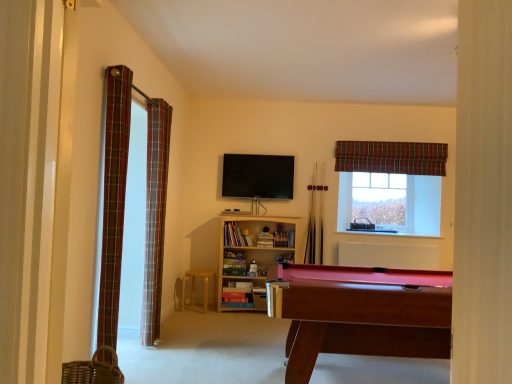
Question: Should I look upward or downward to see plaid fabric curtain at upper right, the 1th curtain when ordered from right to left?

Choices:
 (A) down
 (B) up

Answer: (B)

Question: From the image's perspective, would you say wooden pool cue at center, which is the second cue in left-to-right order, is positioned over clear glass window at upper right?

Choices:
 (A) yes
 (B) no

Answer: (B)

Question: Considering the relative positions of wooden pool cue at center, positioned as the first cue in right-to-left order, and clear glass window at upper right in the image provided, is wooden pool cue at center, positioned as the first cue in right-to-left order, to the right of clear glass window at upper right from the viewer's perspective?

Choices:
 (A) yes
 (B) no

Answer: (B)

Question: Is wooden pool cue at center, which is the second cue in left-to-right order, turned away from clear glass window at upper right?

Choices:
 (A) no
 (B) yes

Answer: (A)

Question: Does wooden pool cue at center, positioned as the first cue in right-to-left order, have a larger size compared to clear glass window at upper right?

Choices:
 (A) no
 (B) yes

Answer: (A)

Question: Is wooden pool cue at center, which is the second cue in left-to-right order, positioned behind clear glass window at upper right?

Choices:
 (A) yes
 (B) no

Answer: (B)

Question: Is wooden pool cue at center, positioned as the first cue in right-to-left order, oriented towards clear glass window at upper right?

Choices:
 (A) yes
 (B) no

Answer: (B)

Question: Is wooden pool cue at center, which is the second cue in left-to-right order, outside wooden billiard table at lower right?

Choices:
 (A) no
 (B) yes

Answer: (B)

Question: Does wooden pool cue at center, which is the second cue in left-to-right order, turn towards wooden billiard table at lower right?

Choices:
 (A) yes
 (B) no

Answer: (B)

Question: From the image's perspective, would you say wooden pool cue at center, positioned as the first cue in right-to-left order, is shown under wooden billiard table at lower right?

Choices:
 (A) yes
 (B) no

Answer: (B)

Question: From a real-world perspective, does wooden pool cue at center, which is the second cue in left-to-right order, sit lower than wooden billiard table at lower right?

Choices:
 (A) yes
 (B) no

Answer: (B)

Question: Can you confirm if wooden pool cue at center, positioned as the first cue in right-to-left order, is smaller than wooden billiard table at lower right?

Choices:
 (A) yes
 (B) no

Answer: (A)

Question: Is wooden pool cue at center, positioned as the first cue in right-to-left order, positioned behind wooden billiard table at lower right?

Choices:
 (A) yes
 (B) no

Answer: (A)

Question: Can you confirm if plaid fabric curtain at upper right, placed as the 3th curtain when sorted from left to right, is taller than wooden pool cue at center, which appears as the 1th cue when viewed from the left?

Choices:
 (A) no
 (B) yes

Answer: (A)